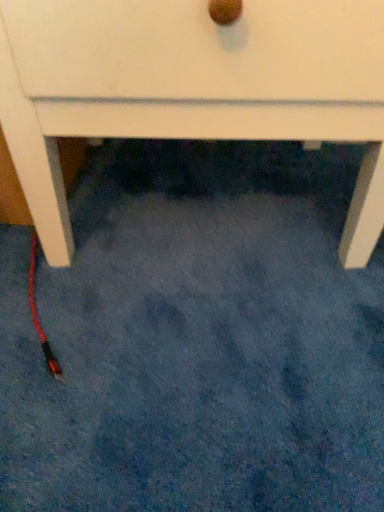
Question: From a real-world perspective, is red rubber cable at lower left physically located above or below white matte chest of drawers at center?

Choices:
 (A) above
 (B) below

Answer: (B)

Question: Do you think red rubber cable at lower left is within white matte chest of drawers at center, or outside of it?

Choices:
 (A) inside
 (B) outside

Answer: (A)

Question: From the image's perspective, relative to white matte chest of drawers at center, is red rubber cable at lower left above or below?

Choices:
 (A) above
 (B) below

Answer: (B)

Question: Looking at the image, does white matte chest of drawers at center seem bigger or smaller compared to red rubber cable at lower left?

Choices:
 (A) big
 (B) small

Answer: (A)

Question: Considering the relative positions of white matte chest of drawers at center and red rubber cable at lower left in the image provided, is white matte chest of drawers at center to the left or to the right of red rubber cable at lower left?

Choices:
 (A) left
 (B) right

Answer: (B)

Question: From a real-world perspective, relative to red rubber cable at lower left, is white matte chest of drawers at center vertically above or below?

Choices:
 (A) above
 (B) below

Answer: (A)

Question: In the image, is white matte chest of drawers at center positioned in front of or behind red rubber cable at lower left?

Choices:
 (A) behind
 (B) front

Answer: (B)